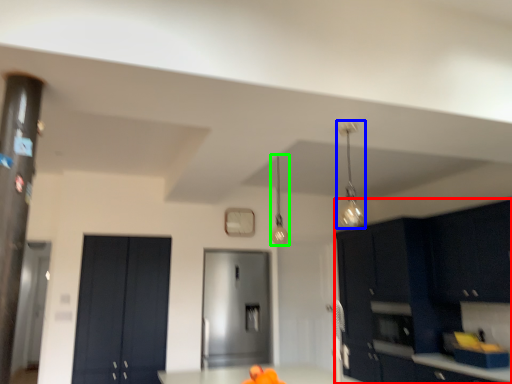
Question: Which object is the closest to the cabinetry (highlighted by a red box)? Choose among these: light fixture (highlighted by a blue box) or light fixture (highlighted by a green box).

Choices:
 (A) light fixture
 (B) light fixture

Answer: (A)